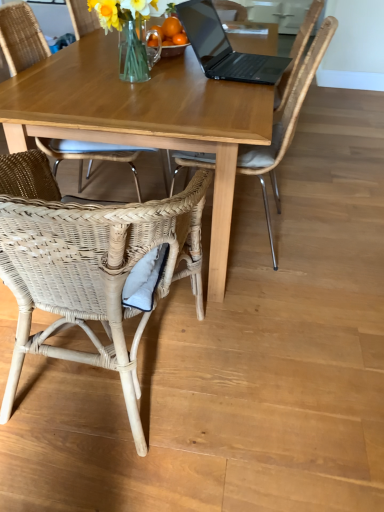
At what (x,y) coordinates should I click in order to perform the action: click on unoccupied region to the right of woven rattan chair at upper center, positioned as the third chair in left-to-right order. Please return your answer as a coordinate pair (x, y). The width and height of the screenshot is (384, 512). Looking at the image, I should click on (333, 230).